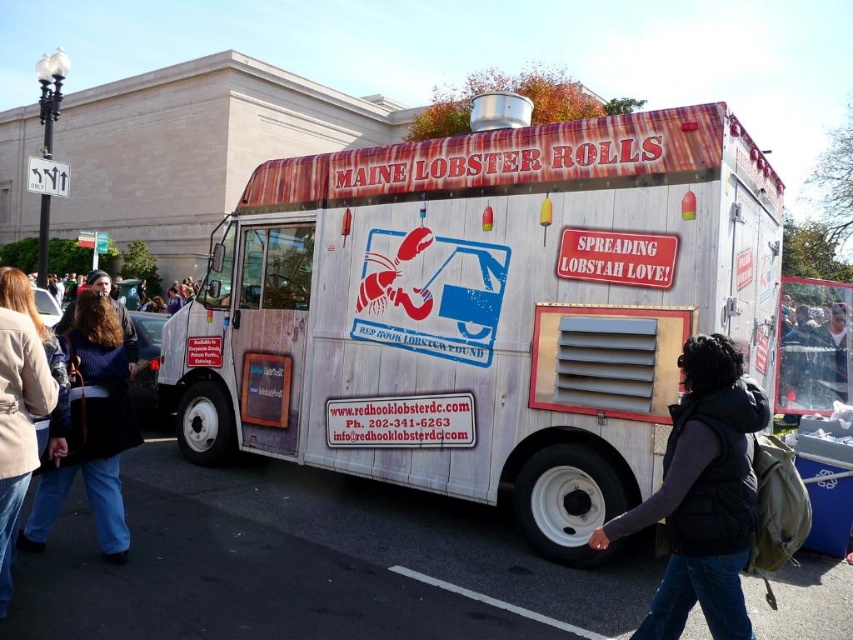
You are a delivery person with a cart that is 1.5 meters wide. You need to move from the wooden food truck at center to the beige leather jacket at lower left. Is there enough space for your cart to pass through the path between them?

The distance between the wooden food truck at center and beige leather jacket at lower left is 3.36 meters, so yes, the cart can pass through since it is wider than the cart.